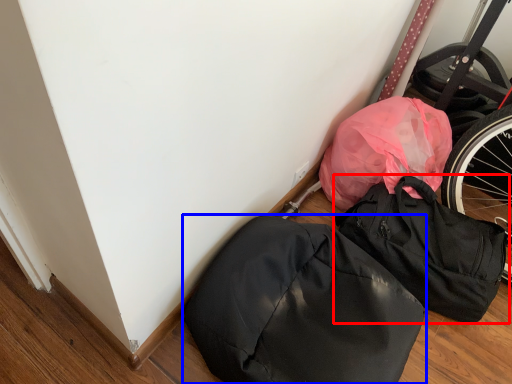
Question: Which object is closer to the camera taking this photo, backpack (highlighted by a red box) or backpack (highlighted by a blue box)?

Choices:
 (A) backpack
 (B) backpack

Answer: (B)